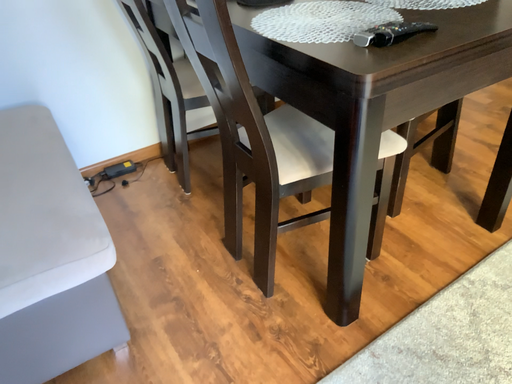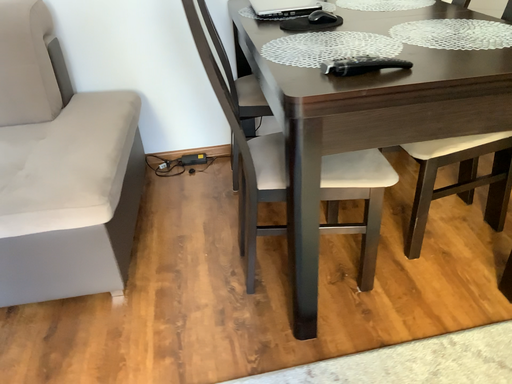
Question: How did the camera likely rotate when shooting the video?

Choices:
 (A) rotated left
 (B) rotated right

Answer: (A)